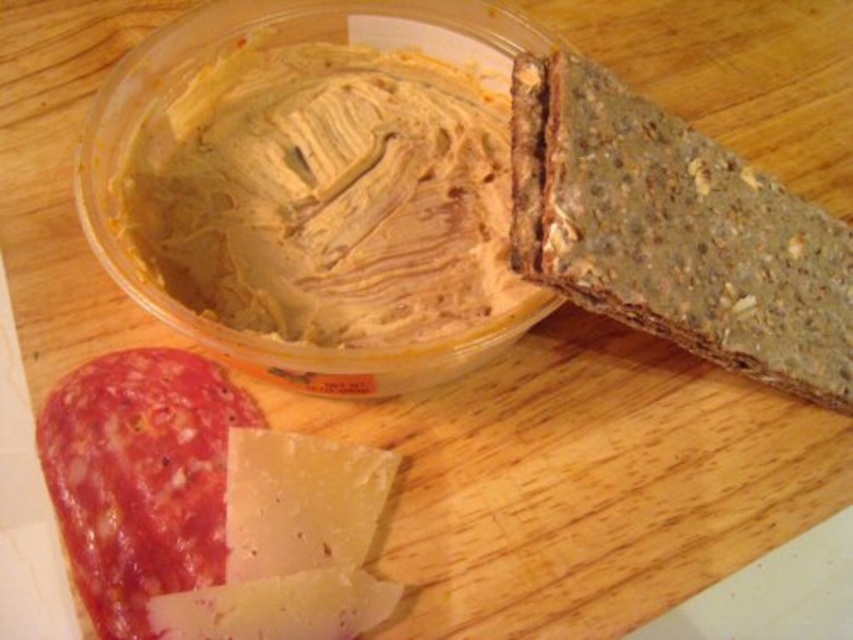
Question: Which of the following is the closest to the observer?

Choices:
 (A) (670, 332)
 (B) (331, 481)

Answer: (B)

Question: Which object is farther from the camera taking this photo?

Choices:
 (A) white crumbly cheese at lower left
 (B) dark brown textured bread at upper right

Answer: (B)

Question: Observing the image, what is the correct spatial positioning of dark brown textured bread at upper right in reference to white crumbly cheese at lower left?

Choices:
 (A) below
 (B) above

Answer: (B)

Question: Is dark brown textured bread at upper right wider than white crumbly cheese at lower left?

Choices:
 (A) no
 (B) yes

Answer: (B)

Question: Is dark brown textured bread at upper right bigger than white crumbly cheese at lower left?

Choices:
 (A) yes
 (B) no

Answer: (A)